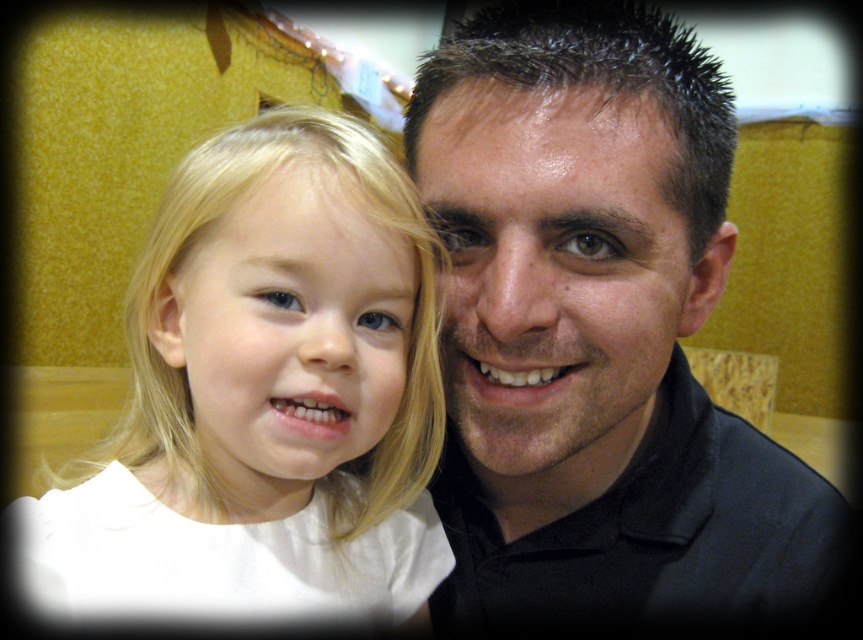
Question: Which point is closer to the camera taking this photo?

Choices:
 (A) (618, 388)
 (B) (470, 272)

Answer: (A)

Question: Is black matte shirt at center wider than smooth blonde hair at left?

Choices:
 (A) no
 (B) yes

Answer: (B)

Question: Can you confirm if smooth skin face at center is positioned below smooth blonde hair at left?

Choices:
 (A) no
 (B) yes

Answer: (A)

Question: Based on their relative distances, which object is nearer to the white matte hair at center?

Choices:
 (A) smooth skin face at center
 (B) black matte shirt at center

Answer: (A)

Question: Which of the following is the closest to the observer?

Choices:
 (A) black matte shirt at center
 (B) smooth skin face at center
 (C) smooth blonde hair at left

Answer: (C)

Question: Is white matte hair at center closer to the viewer compared to smooth blonde hair at left?

Choices:
 (A) yes
 (B) no

Answer: (A)